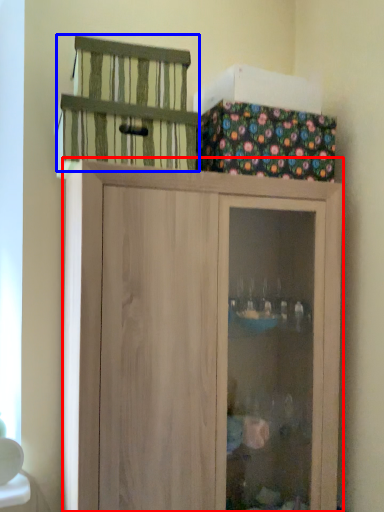
Question: Among these objects, which one is farthest to the camera, cupboard (highlighted by a red box) or cage (highlighted by a blue box)?

Choices:
 (A) cupboard
 (B) cage

Answer: (B)